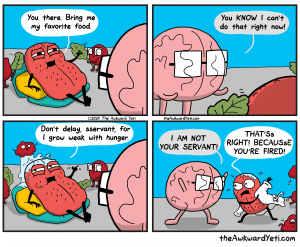
This screenshot has height=247, width=300. What are the coordinates of `floor` in the screenshot? It's located at (98, 226).